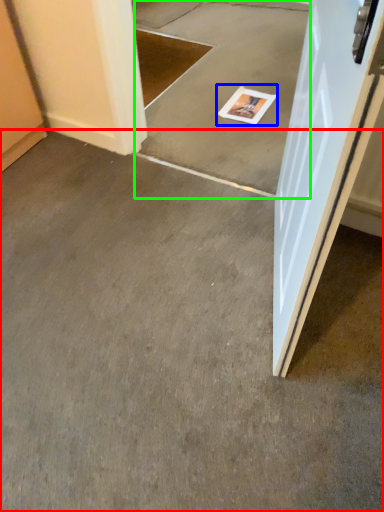
Question: Which object is the farthest from concrete (highlighted by a red box)? Choose among these: magazine (highlighted by a blue box) or concrete (highlighted by a green box).

Choices:
 (A) magazine
 (B) concrete

Answer: (A)